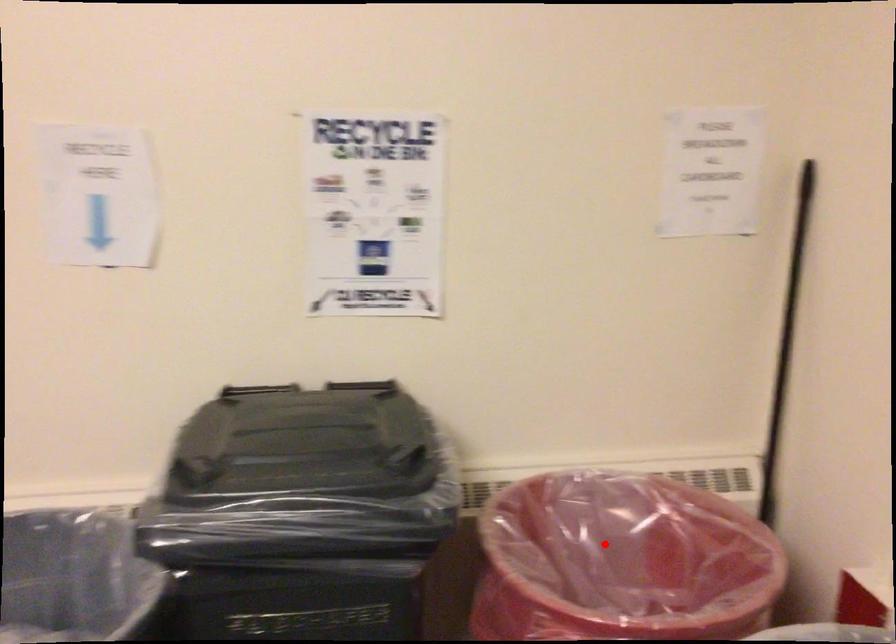
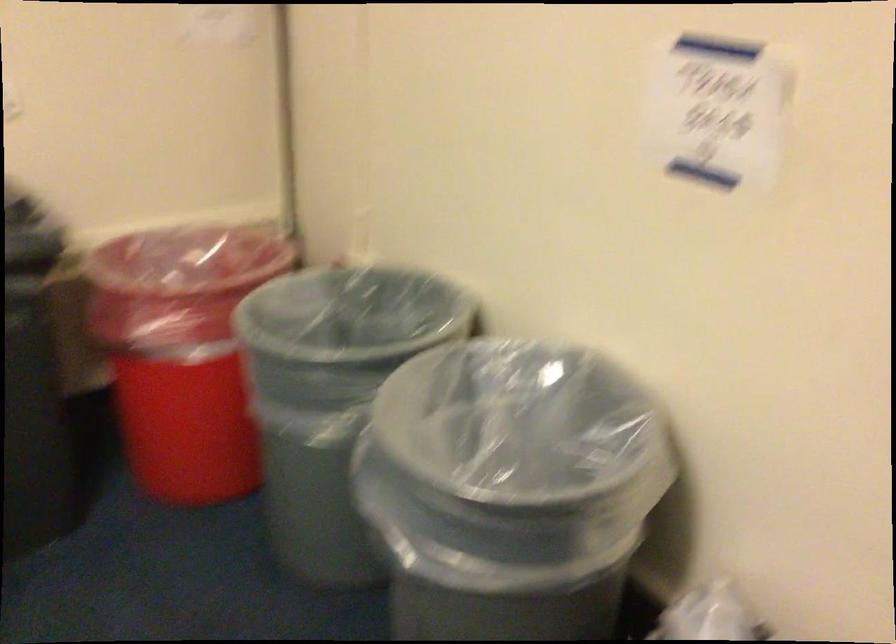
Find the pixel in the second image that matches the highlighted location in the first image.

(178, 276)